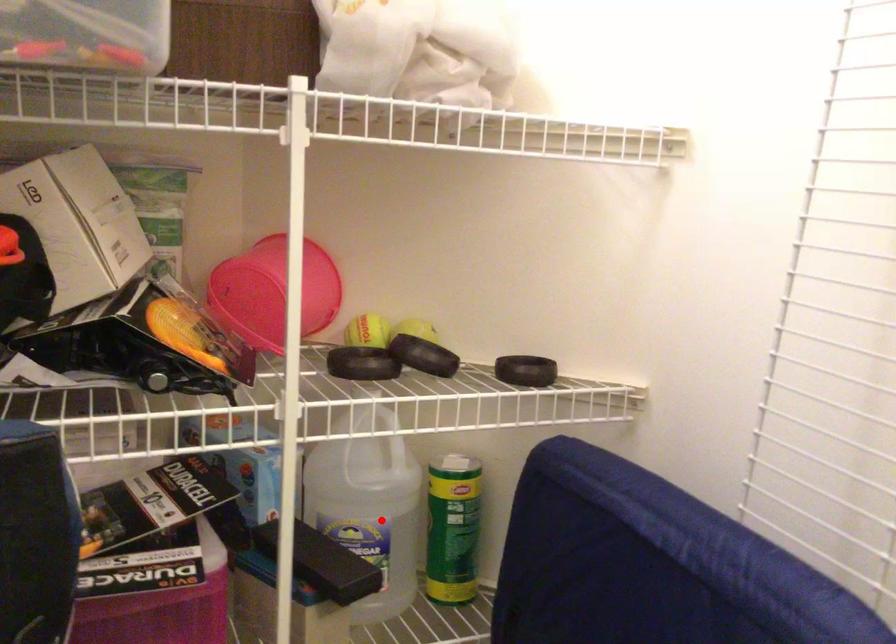
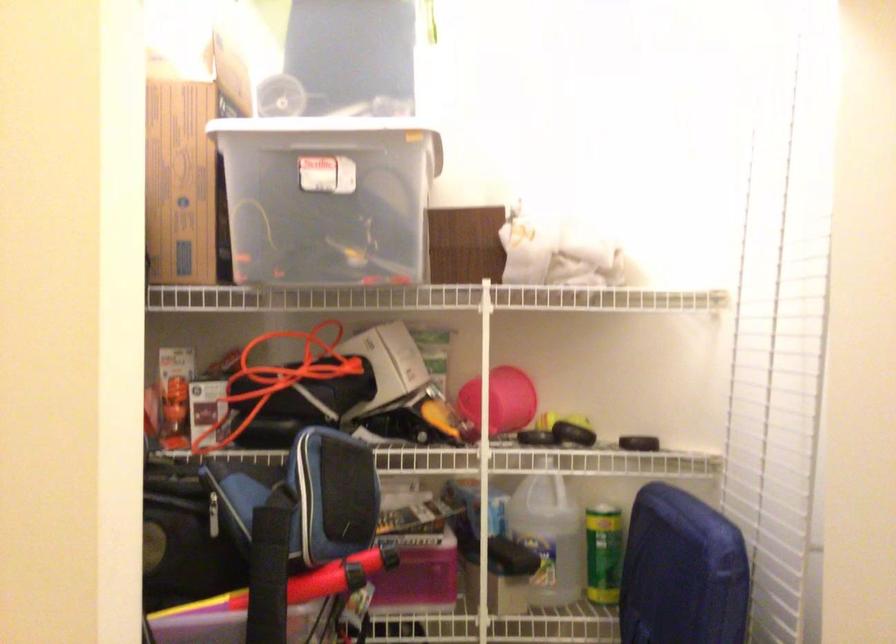
Question: I am providing you with two images of the same scene from different viewpoints. Given a red point in image1, look at the same physical point in image2. Is it:

Choices:
 (A) Closer to the viewpoint
 (B) Farther from the viewpoint

Answer: (B)